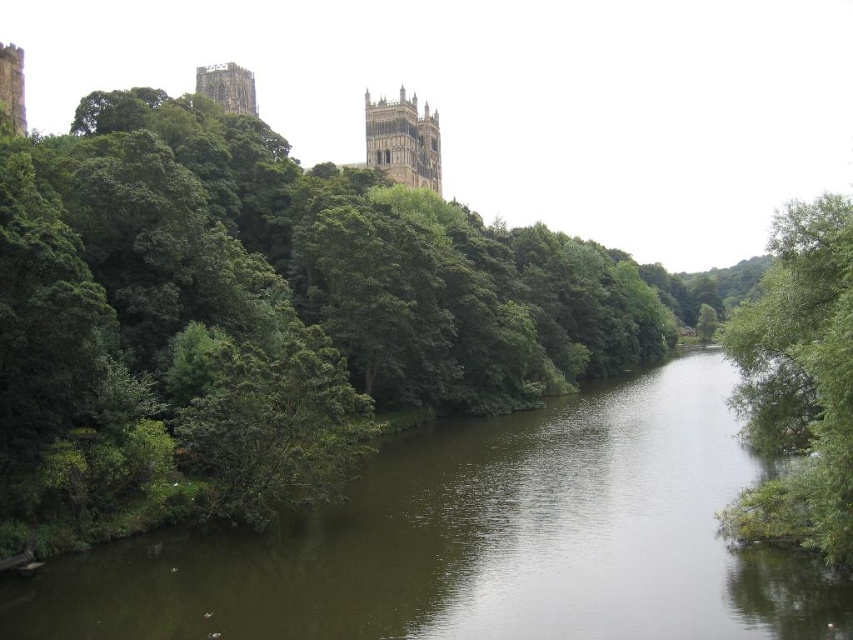
Question: Is green leafy tree at upper left to the left of green leafy tree at right from the viewer's perspective?

Choices:
 (A) no
 (B) yes

Answer: (B)

Question: Which object appears farthest from the camera in this image?

Choices:
 (A) green leafy tree at right
 (B) brown stone tower at upper center

Answer: (B)

Question: Does green leafy tree at upper left appear under green murky water at center?

Choices:
 (A) yes
 (B) no

Answer: (B)

Question: Which object appears farthest from the camera in this image?

Choices:
 (A) stone tower at upper left
 (B) green murky water at center
 (C) green leafy tree at upper left

Answer: (A)

Question: Which of the following is the closest to the observer?

Choices:
 (A) brown stone tower at upper center
 (B) green leafy tree at right

Answer: (B)

Question: Is green murky water at center positioned at the back of stone tower at upper left?

Choices:
 (A) yes
 (B) no

Answer: (B)